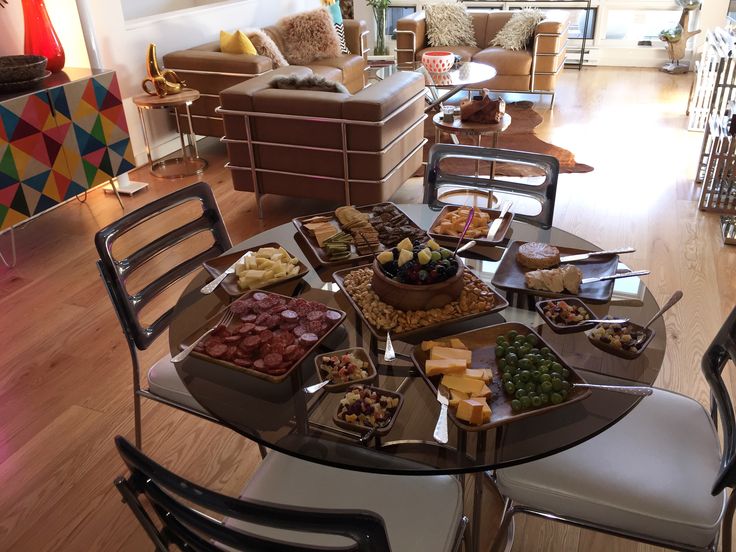
At what (x,y) coordinates should I click in order to perform the action: click on end table. Please return your answer as a coordinate pair (x, y). Looking at the image, I should click on (163, 100).